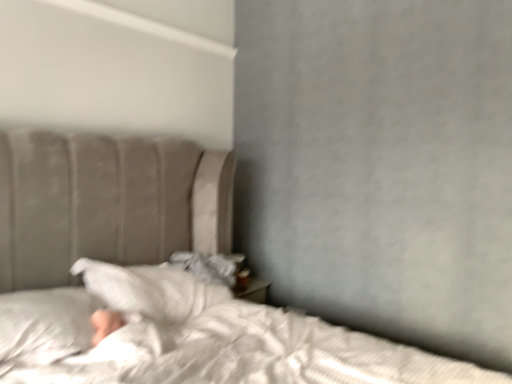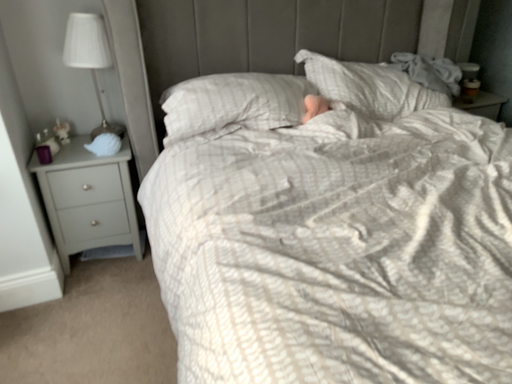
Question: How did the camera likely rotate when shooting the video?

Choices:
 (A) rotated left
 (B) rotated right

Answer: (A)